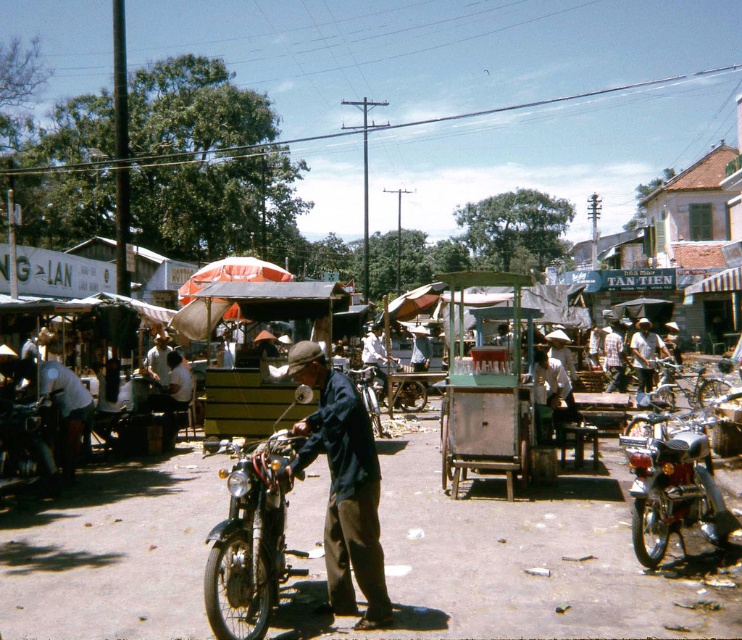
Does shiny black motorcycle at center appear on the right side of light brown fabric hat at center?

In fact, shiny black motorcycle at center is to the left of light brown fabric hat at center.

Between shiny black motorcycle at center and light brown fabric hat at center, which one is positioned lower?

shiny black motorcycle at center

Locate an element on the screen. The height and width of the screenshot is (640, 742). shiny black motorcycle at center is located at coordinates (249, 540).

Between dark blue fabric at center and shiny black motorcycle at center, which one is positioned higher?

dark blue fabric at center is above.

Does point (367, 508) lie behind point (269, 573)?

No, it is in front of (269, 573).

This screenshot has width=742, height=640. What are the coordinates of `dark blue fabric at center` in the screenshot? It's located at (344, 484).

Which is more to the right, dark blue fabric at center or light brown fabric hat at center?

light brown fabric hat at center

Between point (341, 529) and point (659, 337), which one is positioned in front?

Point (341, 529) is more forward.

Locate an element on the screen. Image resolution: width=742 pixels, height=640 pixels. dark blue fabric at center is located at coordinates (344, 484).